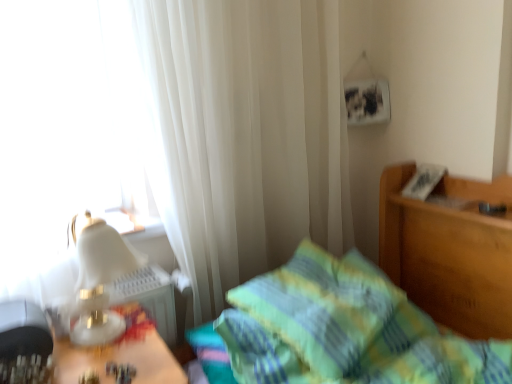
Question: Relative to green plaid bedspread at center, is white sheer curtain at upper left in front or behind?

Choices:
 (A) front
 (B) behind

Answer: (B)

Question: Is point (325, 203) closer or farther from the camera than point (481, 273)?

Choices:
 (A) farther
 (B) closer

Answer: (A)

Question: Estimate the real-world distances between objects in this image. Which object is farther from the white sheer curtain at upper left?

Choices:
 (A) green plaid bedspread at center
 (B) white glossy table lamp at left
 (C) green plaid pillow at center

Answer: (B)

Question: Which object is the closest to the white glossy table lamp at left?

Choices:
 (A) white sheer curtain at upper left
 (B) green plaid bedspread at center
 (C) green plaid pillow at center

Answer: (C)